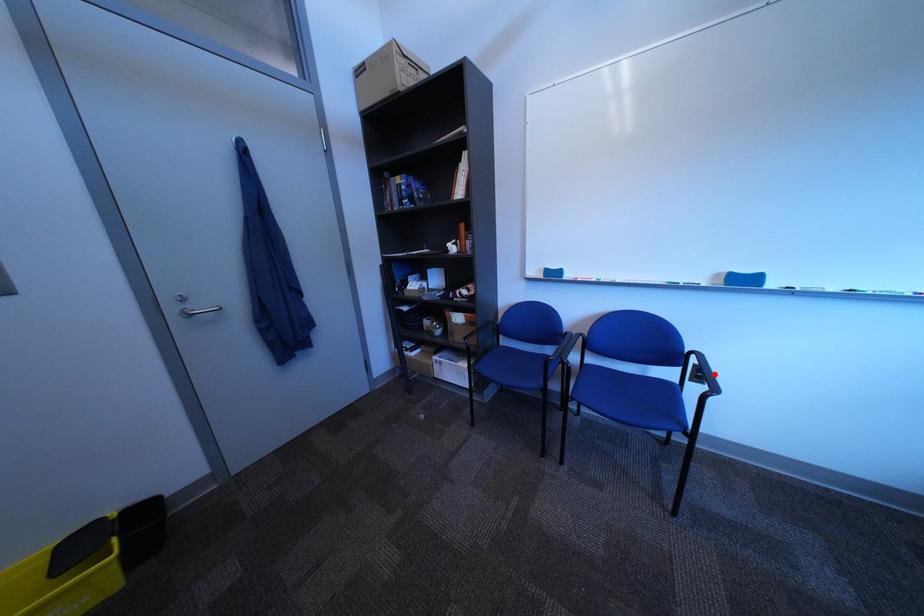
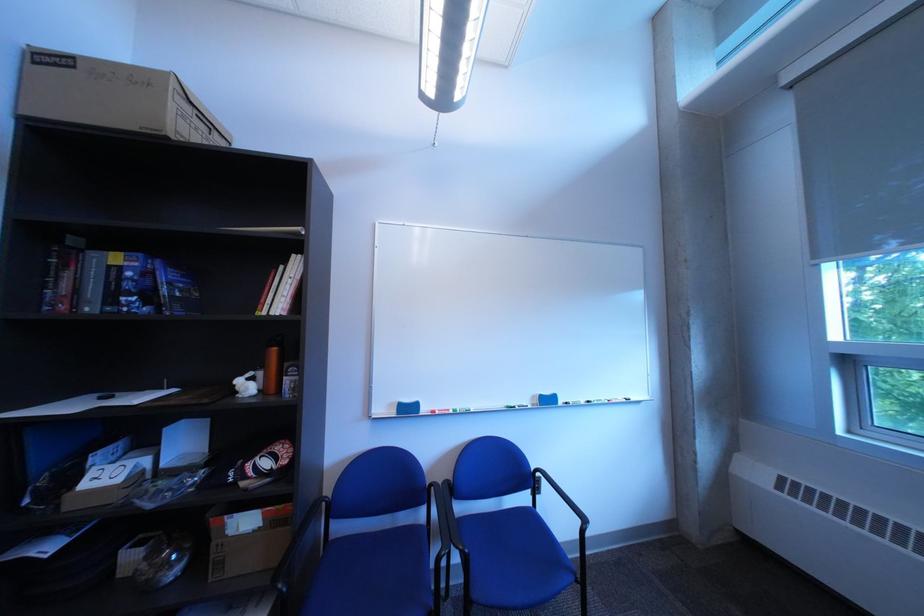
The point at the highlighted location is marked in the first image. Where is the corresponding point in the second image?

(552, 485)